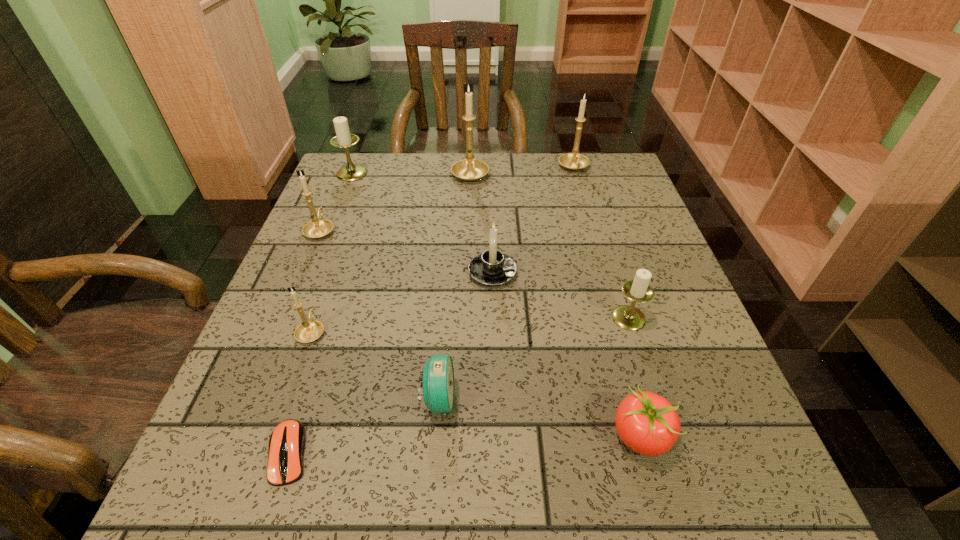
Locate an element on the screen. the nearest gold candle holder is located at coordinates (308, 331).

The height and width of the screenshot is (540, 960). I want to click on the right white candle holder, so click(628, 317).

Identify the location of the smaller white candle holder. (628, 317).

Locate an element on the screen. Image resolution: width=960 pixels, height=540 pixels. blue alarm clock is located at coordinates (438, 383).

You are a GUI agent. You are given a task and a screenshot of the screen. Output one action in this format:
    pyautogui.click(x=<x>, y=<y>)
    Task: Click on the tomato
    This screenshot has width=960, height=540.
    Given the screenshot: What is the action you would take?
    pyautogui.click(x=647, y=423)

This screenshot has height=540, width=960. Find the location of `the shortest object`. the shortest object is located at coordinates (286, 447).

Where is `orange computer mouse`? The image size is (960, 540). orange computer mouse is located at coordinates point(286,447).

Where is `free space located on the handle side of the rightmost gold candle holder`? free space located on the handle side of the rightmost gold candle holder is located at coordinates (602, 264).

The height and width of the screenshot is (540, 960). I want to click on free region located 0.120m on the handle side of the fourth nearest candle holder, so click(x=337, y=192).

Where is `vacant space located on the handle side of the fourth nearest candle holder`? vacant space located on the handle side of the fourth nearest candle holder is located at coordinates (340, 184).